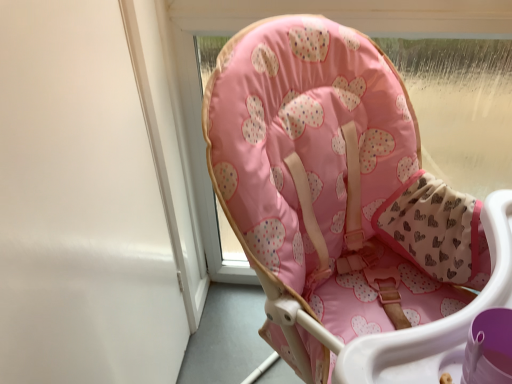
Question: Is pink fabric baby chair at center oriented towards white matte screen door at upper left?

Choices:
 (A) yes
 (B) no

Answer: (B)

Question: From a real-world perspective, is pink fabric baby chair at center located higher than white matte screen door at upper left?

Choices:
 (A) no
 (B) yes

Answer: (A)

Question: Is pink fabric baby chair at center not close to white matte screen door at upper left?

Choices:
 (A) no
 (B) yes

Answer: (A)

Question: Is pink fabric baby chair at center positioned beyond the bounds of white matte screen door at upper left?

Choices:
 (A) no
 (B) yes

Answer: (B)

Question: Can you confirm if pink fabric baby chair at center is bigger than white matte screen door at upper left?

Choices:
 (A) no
 (B) yes

Answer: (B)

Question: Is pink fabric baby chair at center thinner than white matte screen door at upper left?

Choices:
 (A) no
 (B) yes

Answer: (A)

Question: Considering the relative sizes of white matte screen door at upper left and pink fabric baby chair at center in the image provided, is white matte screen door at upper left wider than pink fabric baby chair at center?

Choices:
 (A) yes
 (B) no

Answer: (B)

Question: Is white matte screen door at upper left positioned before pink fabric baby chair at center?

Choices:
 (A) no
 (B) yes

Answer: (A)

Question: Is white matte screen door at upper left shorter than pink fabric baby chair at center?

Choices:
 (A) no
 (B) yes

Answer: (B)

Question: Is white matte screen door at upper left outside of pink fabric baby chair at center?

Choices:
 (A) yes
 (B) no

Answer: (A)

Question: From a real-world perspective, is white matte screen door at upper left physically below pink fabric baby chair at center?

Choices:
 (A) no
 (B) yes

Answer: (A)

Question: Does white matte screen door at upper left have a smaller size compared to pink fabric baby chair at center?

Choices:
 (A) yes
 (B) no

Answer: (A)

Question: From the image's perspective, is white matte screen door at upper left above or below pink fabric baby chair at center?

Choices:
 (A) below
 (B) above

Answer: (B)